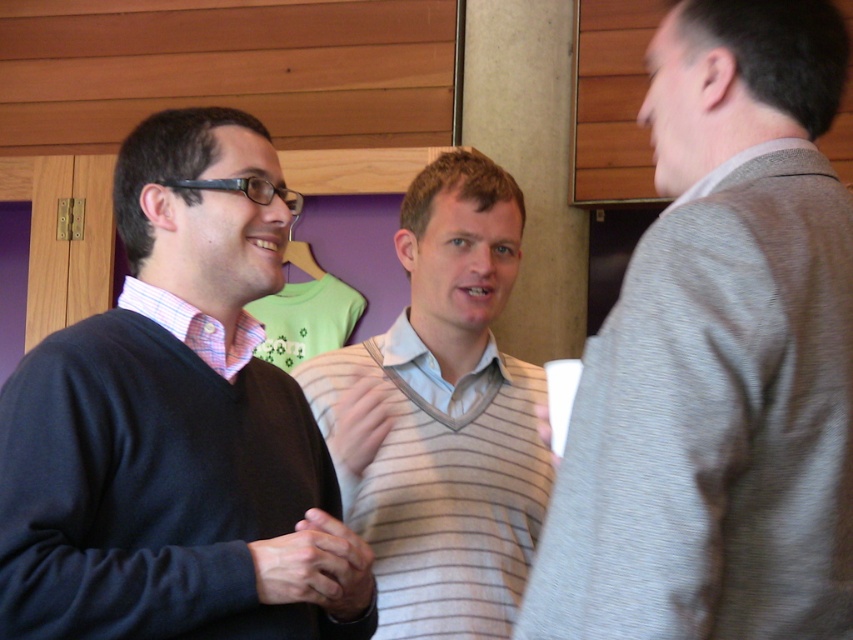
Between point (654, 561) and point (100, 342), which one is positioned behind?

The point (100, 342) is behind.

Does striped sweater at right appear on the left side of matte black sweater at left?

No, striped sweater at right is not to the left of matte black sweater at left.

This screenshot has width=853, height=640. Describe the element at coordinates (718, 358) in the screenshot. I see `striped sweater at right` at that location.

The width and height of the screenshot is (853, 640). What are the coordinates of `striped sweater at right` in the screenshot? It's located at (718, 358).

Is striped sweater at right to the left of pink checkered shirt at left from the viewer's perspective?

In fact, striped sweater at right is to the right of pink checkered shirt at left.

Who is lower down, striped sweater at right or pink checkered shirt at left?

pink checkered shirt at left is below.

Is point (709, 374) in front of point (207, 323)?

That is True.

You are a GUI agent. You are given a task and a screenshot of the screen. Output one action in this format:
    pyautogui.click(x=<x>, y=<y>)
    Task: Click on the striped sweater at right
    The width and height of the screenshot is (853, 640).
    Given the screenshot: What is the action you would take?
    pyautogui.click(x=718, y=358)

What are the coordinates of `striped sweater at center` in the screenshot? It's located at (442, 417).

Is striped sweater at center smaller than pink checkered shirt at left?

Actually, striped sweater at center might be larger than pink checkered shirt at left.

Is point (461, 304) in front of point (146, 291)?

No, (461, 304) is further to viewer.

Where is `striped sweater at center`? striped sweater at center is located at coordinates (442, 417).